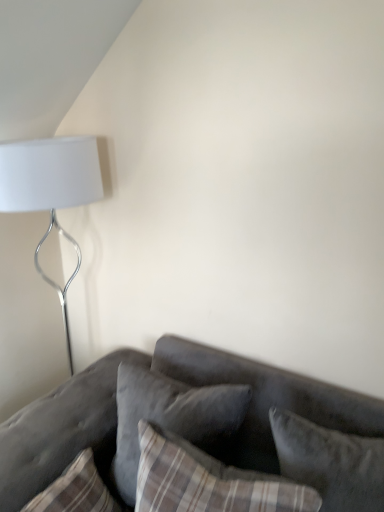
Question: Is white matte lamp at upper left spatially inside velvet gray pillow at lower right, acting as the first pillow starting from the right, or outside of it?

Choices:
 (A) inside
 (B) outside

Answer: (B)

Question: Considering their positions, is white matte lamp at upper left located in front of or behind velvet gray pillow at lower right, the third pillow viewed from the left?

Choices:
 (A) behind
 (B) front

Answer: (A)

Question: Based on their relative distances, which object is nearer to the velvet gray pillow at center, arranged as the 2th pillow when viewed from the right?

Choices:
 (A) velvet gray couch at lower right
 (B) velvet gray pillow at lower right, the third pillow viewed from the left
 (C) white matte lamp at upper left
 (D) plaid fabric pillow at lower left, which ranks as the third pillow in right-to-left order

Answer: (A)

Question: Considering the real-world distances, which object is closest to the velvet gray couch at lower right?

Choices:
 (A) white matte lamp at upper left
 (B) velvet gray pillow at center, arranged as the 2th pillow when viewed from the right
 (C) velvet gray pillow at lower right, the third pillow viewed from the left
 (D) plaid fabric pillow at lower left, which is the first pillow from left to right

Answer: (B)